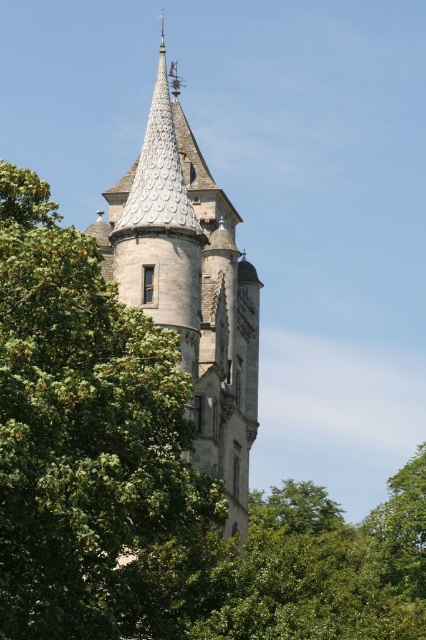
Question: Is green leafy tree at center to the left of stone steeple at center from the viewer's perspective?

Choices:
 (A) no
 (B) yes

Answer: (B)

Question: From the image, what is the correct spatial relationship of green leafy tree at center in relation to stone steeple at center?

Choices:
 (A) below
 (B) above

Answer: (A)

Question: Which point is closer to the camera?

Choices:
 (A) green leafy tree at center
 (B) stone steeple at center

Answer: (A)

Question: Considering the relative positions of green leafy tree at center and stone steeple at center in the image provided, where is green leafy tree at center located with respect to stone steeple at center?

Choices:
 (A) above
 (B) below

Answer: (B)

Question: Which point is closer to the camera taking this photo?

Choices:
 (A) (143, 628)
 (B) (147, 291)

Answer: (A)